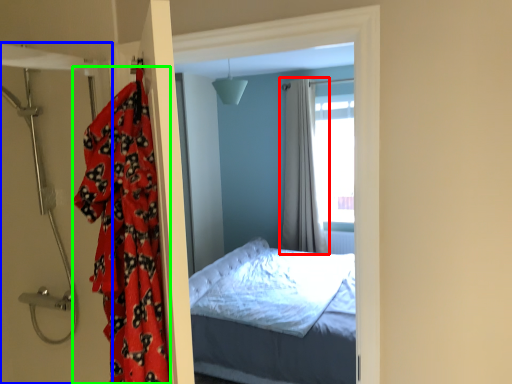
Question: Estimate the real-world distances between objects in this image. Which object is closer to curtain (highlighted by a red box), door (highlighted by a blue box) or blanket (highlighted by a green box)?

Choices:
 (A) door
 (B) blanket

Answer: (A)